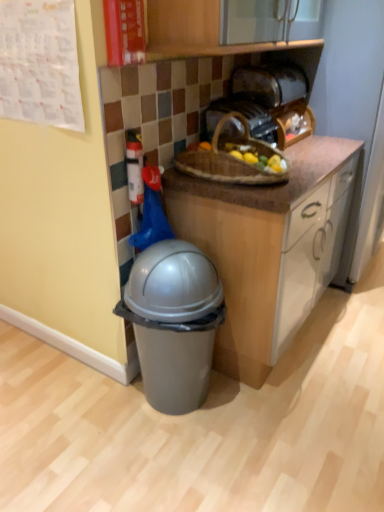
In order to click on free location to the right of gray plastic trash can at lower left in this screenshot , I will do `click(263, 414)`.